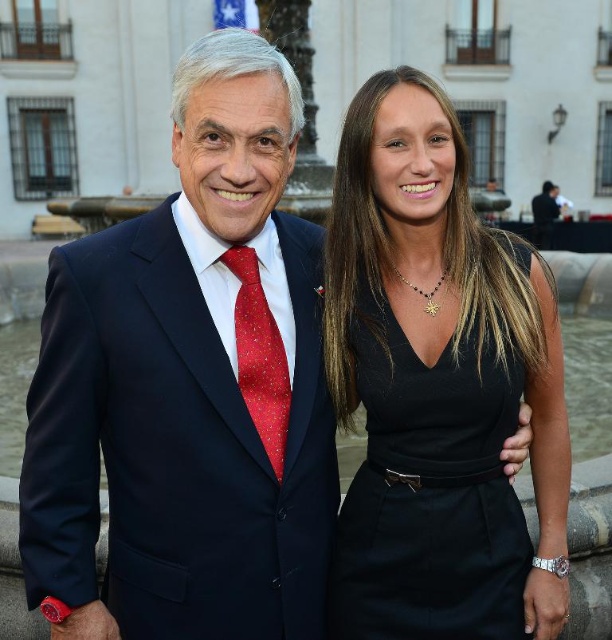
You are a photographer setting up for a group photo. You need to ensure that the black satin dress at center and the red dotted fabric tie at left are both in focus. Given that your camera has a depth of field that can cover objects within a 5 meter range, will both subjects be in focus?

The distance between the black satin dress at center and the red dotted fabric tie at left is 6.40 meters. Since the camera can only cover 5 meters within its depth of field, the two objects are too far apart to both be in focus simultaneously.

You are a photographer adjusting your camera settings. You notice the navy blue suit at left and the red dotted fabric tie at left in your frame. Which object should you focus on first if you want to ensure both are in focus, considering their positions?

The navy blue suit at left is much taller than the red dotted fabric tie at left, so focusing on the navy blue suit at left first would ensure both are in focus since it is closer to the camera.